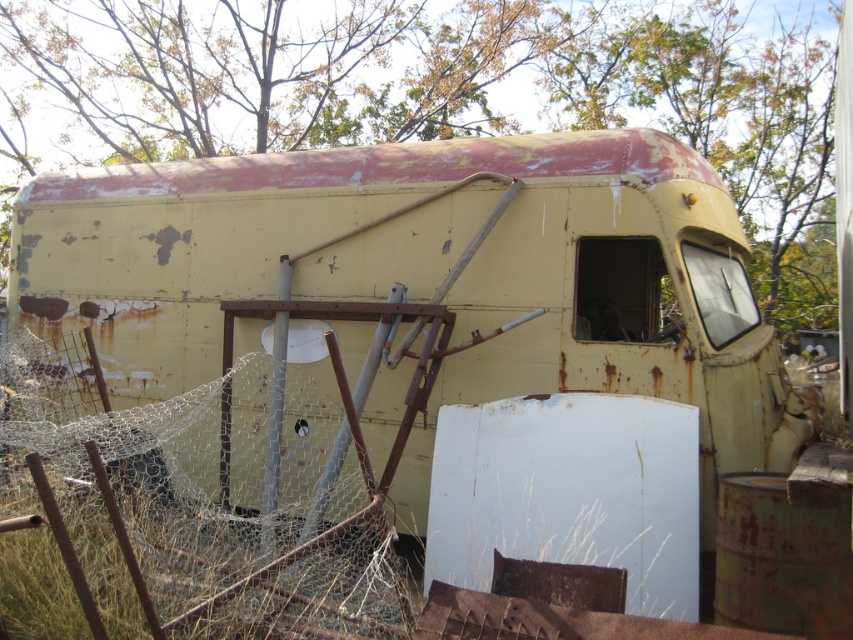
Question: Is rusty yellow trailer at center wider than rusty wire mesh at center?

Choices:
 (A) no
 (B) yes

Answer: (B)

Question: Can you confirm if rusty yellow trailer at center is positioned to the right of rusty wire mesh at center?

Choices:
 (A) no
 (B) yes

Answer: (B)

Question: Which of the following is the closest to the observer?

Choices:
 (A) (244, 428)
 (B) (761, 369)

Answer: (B)

Question: Does rusty yellow trailer at center lie behind rusty wire mesh at center?

Choices:
 (A) no
 (B) yes

Answer: (B)